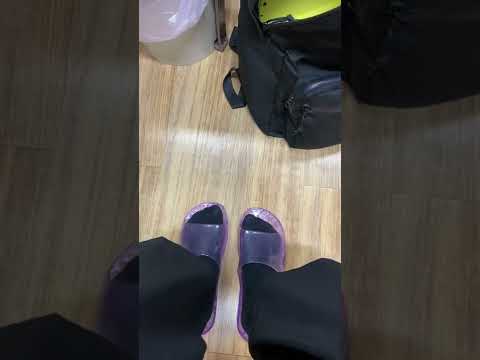
Where is `right slipper`? right slipper is located at coordinates (274, 221).